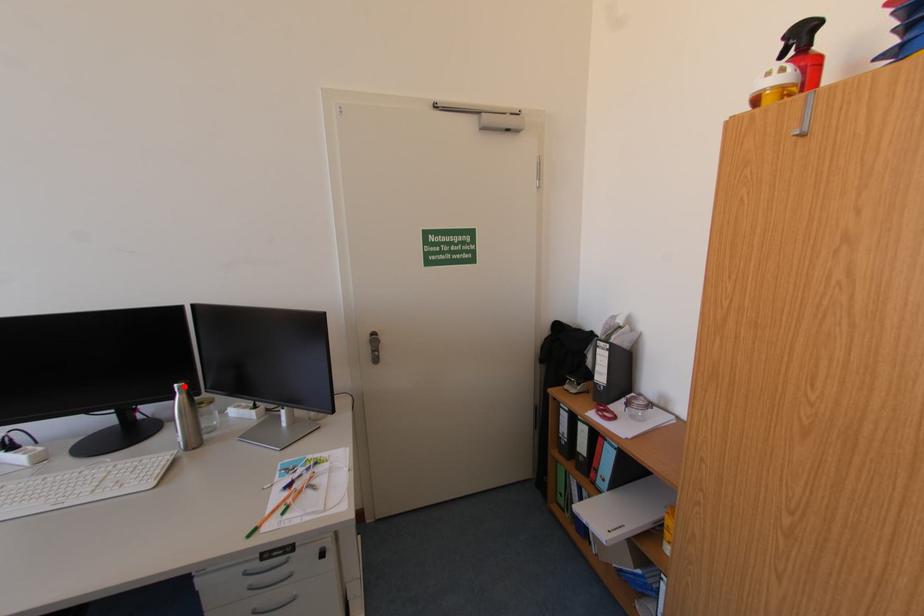
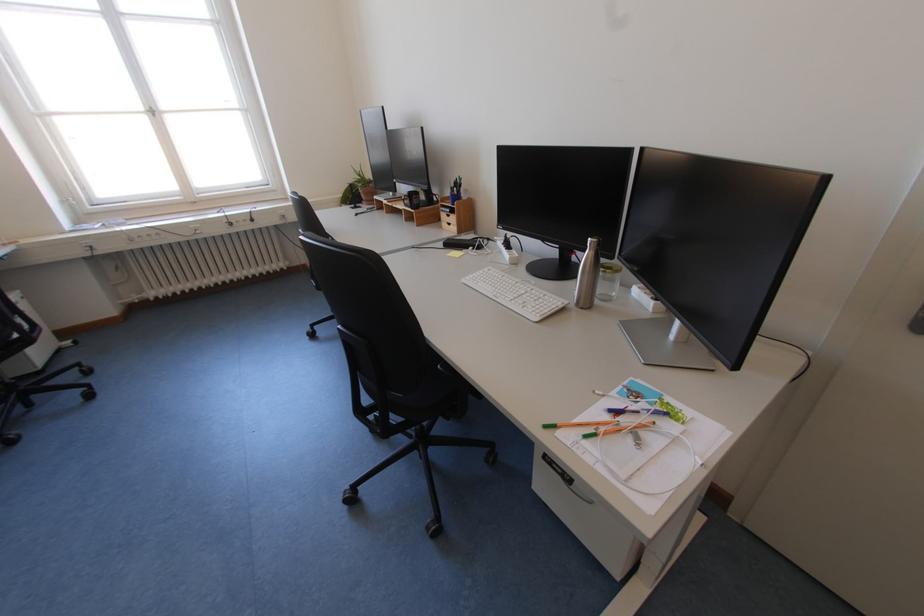
Question: A red point is marked in image1. In image2, is the corresponding 3D point closer to the camera or farther? Reply with the corresponding letter.

Choices:
 (A) The corresponding 3D point is closer.
 (B) The corresponding 3D point is farther.

Answer: (A)